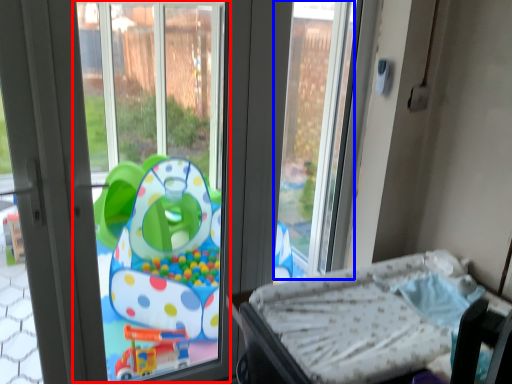
Question: Which point is further to the camera, window screen (highlighted by a red box) or window screen (highlighted by a blue box)?

Choices:
 (A) window screen
 (B) window screen

Answer: (B)